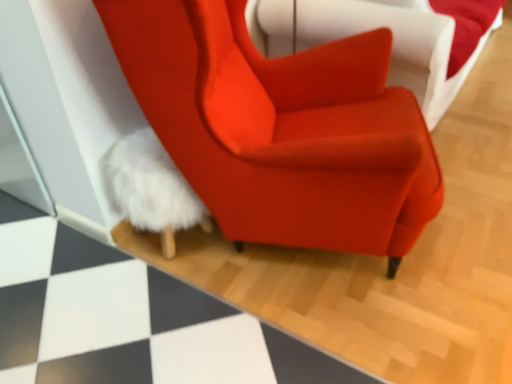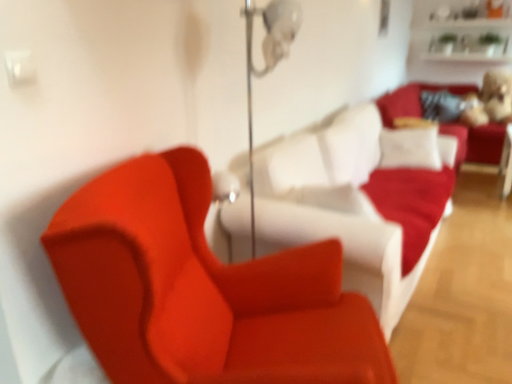
Question: Which way did the camera rotate in the video?

Choices:
 (A) rotated downward
 (B) rotated upward

Answer: (B)